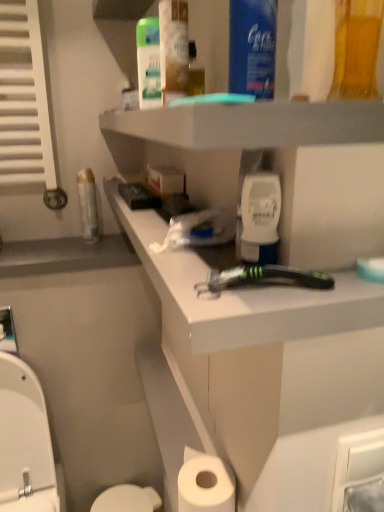
I want to click on vacant space to the left of clear plastic bottle at left, the 1th mouthwash viewed from the back, so click(x=44, y=245).